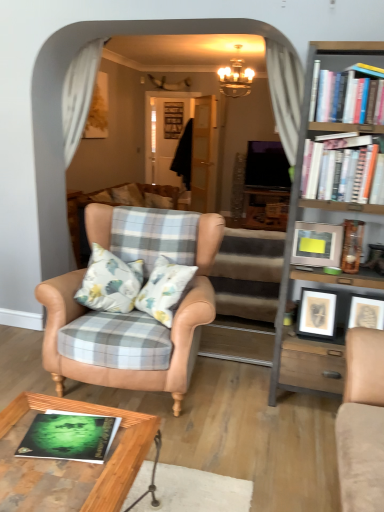
Question: Considering the positions of leather armchair at center and white paperbacks at upper right, arranged as the 2th book when viewed from the left, in the image, is leather armchair at center wider or thinner than white paperbacks at upper right, arranged as the 2th book when viewed from the left,?

Choices:
 (A) wide
 (B) thin

Answer: (A)

Question: Is leather armchair at center taller or shorter than white paperbacks at upper right, arranged as the 2th book when viewed from the left?

Choices:
 (A) short
 (B) tall

Answer: (B)

Question: Estimate the real-world distances between objects in this image. Which object is farther from the wooden bookcase at right?

Choices:
 (A) metallic silver picture frame at right, which ranks as the 1th picture frame in top-to-bottom order
 (B) woodenwoodentable at lower center
 (C) white glossy door at center, which is counted as the second glass door, starting from the back
 (D) leather armchair at center
 (E) gold metallic chandelier at upper center

Answer: (E)

Question: Estimate the real-world distances between objects in this image. Which object is farther from the matte black picture frame at center right, placed as the first picture frame when sorted from bottom to top?

Choices:
 (A) white paperbacks at upper right, arranged as the 2th book when viewed from the front
 (B) woodenwoodentable at lower center
 (C) leather armchair at center
 (D) black fabric at center, the 1th glass door in the back-to-front sequence
 (E) green matte book at lower left, which ranks as the second book in right-to-left order

Answer: (D)